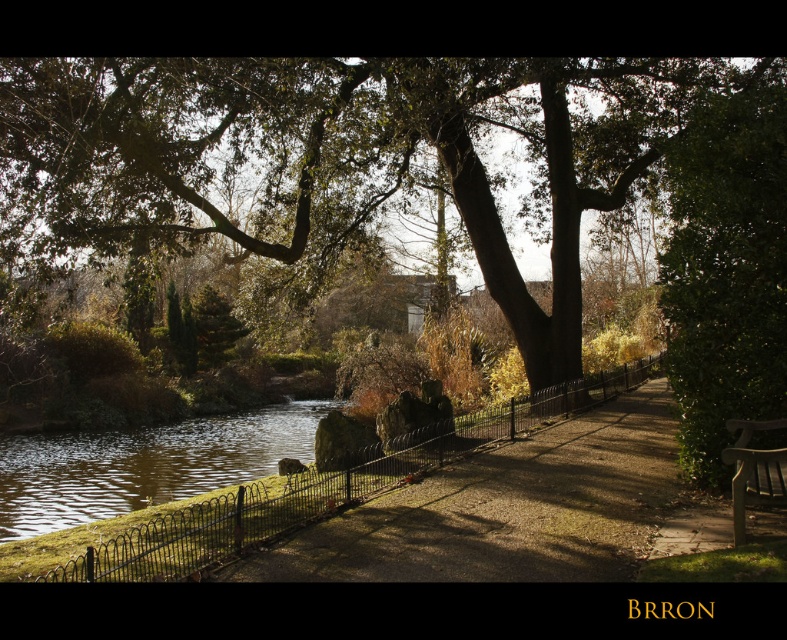
You are a gardener trying to mow the lawn. You see the brown gravel path at center and the green mossy rock at lower left. Which object is located above the other?

The brown gravel path at center is positioned over green mossy rock at lower left, so the brown gravel path at center is above the green mossy rock at lower left.

You are a gardener who needs to water the green leafy tree at center and the brown gravel path at center. Since the water source is behind you, which object should you water first to avoid walking over the one you just watered?

You should water the green leafy tree at center first because the brown gravel path at center is behind it. If you water the path first, you would have to walk over it afterward, which might not be necessary since gravel paths typically don

In the scene shown: You are a park visitor who wants to sit on the brown wooden bench at lower right. Before sitting, you notice the green mossy rock at lower left. Which object is bigger in size?

The green mossy rock at lower left is larger in size compared to the brown wooden bench at lower right, so the rock is bigger.